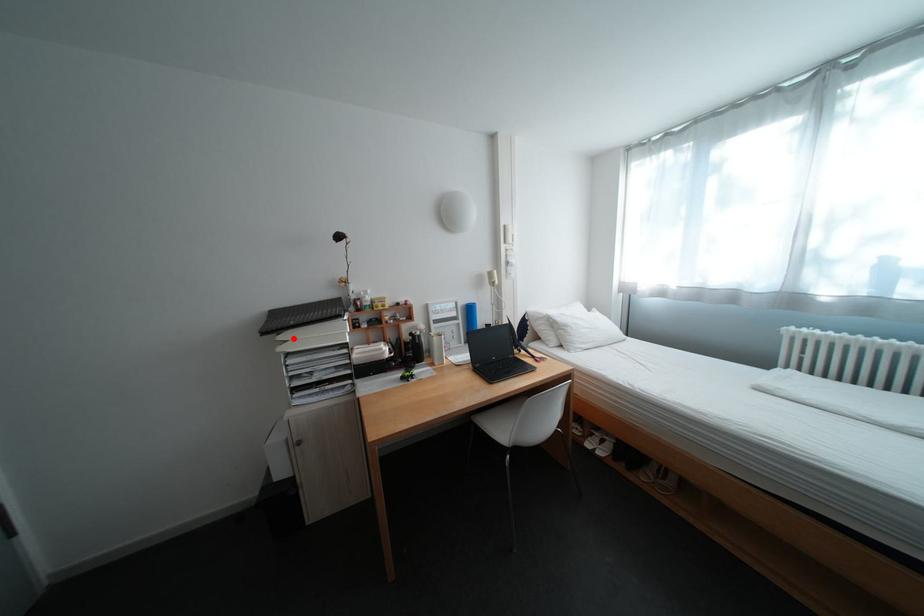
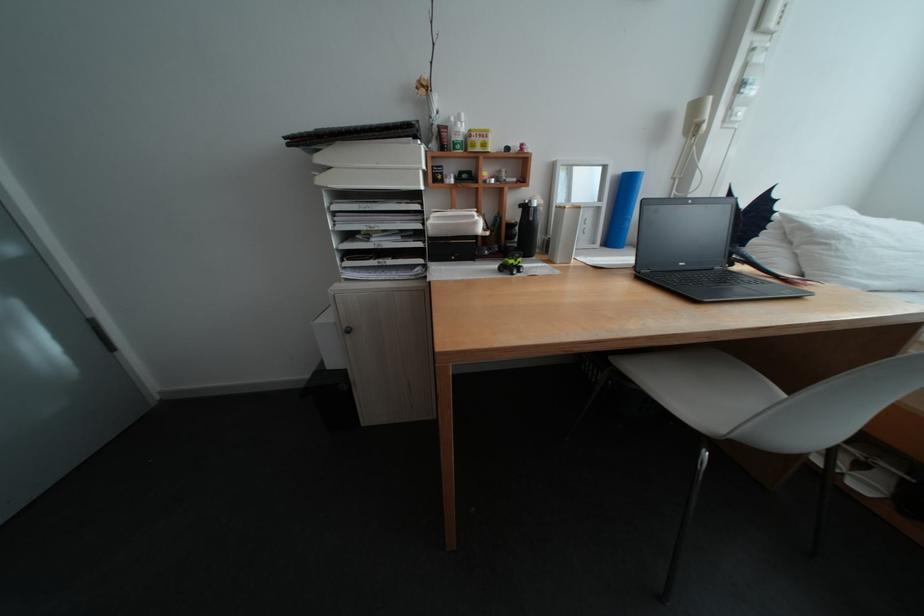
Where in the second image is the point corresponding to the highlighted location from the first image?

(333, 160)